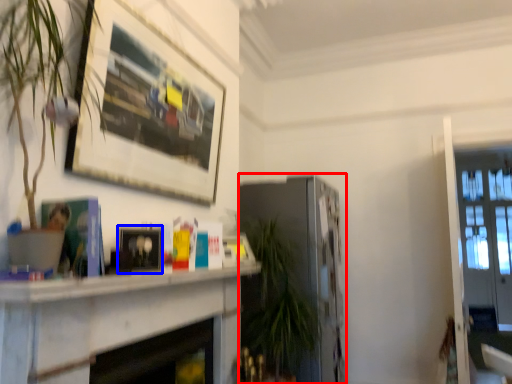
Question: Among these objects, which one is farthest to the camera, fireplace (highlighted by a red box) or picture frame (highlighted by a blue box)?

Choices:
 (A) fireplace
 (B) picture frame

Answer: (A)